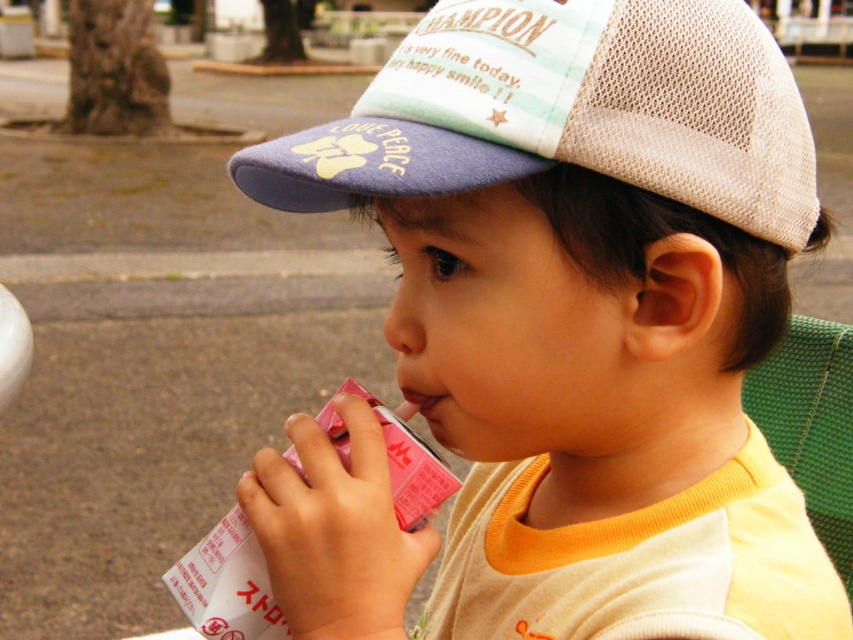
Does matte plastic cup at center appear on the right side of pastel striped mesh cap at upper center?

Yes, matte plastic cup at center is to the right of pastel striped mesh cap at upper center.

Between point (752, 257) and point (421, 106), which one is positioned behind?

Point (752, 257)

You are a GUI agent. You are given a task and a screenshot of the screen. Output one action in this format:
    pyautogui.click(x=<x>, y=<y>)
    Task: Click on the matte plastic cup at center
    This screenshot has height=640, width=853.
    Given the screenshot: What is the action you would take?
    pyautogui.click(x=589, y=307)